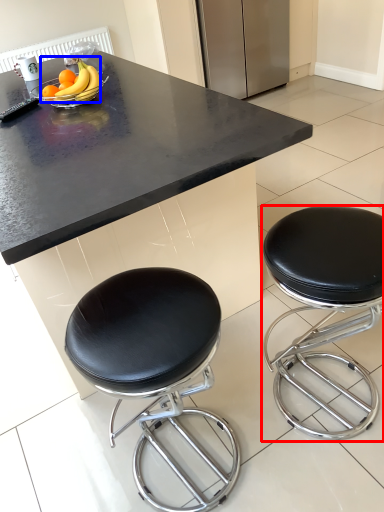
Question: Among these objects, which one is farthest to the camera, stool (highlighted by a red box) or banana (highlighted by a blue box)?

Choices:
 (A) stool
 (B) banana

Answer: (B)